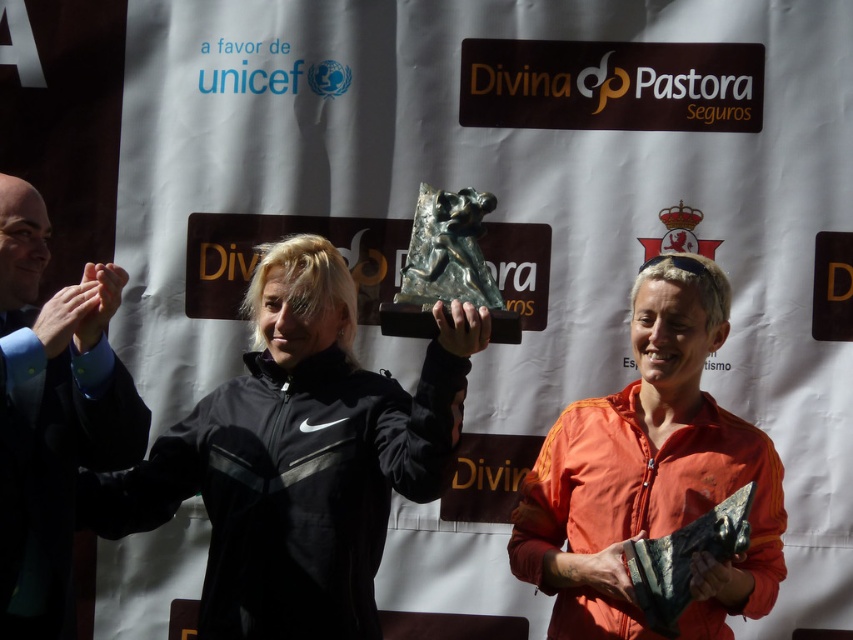
Question: Which of the following is the farthest from the observer?

Choices:
 (A) (585, 404)
 (B) (4, 328)

Answer: (A)

Question: Can you confirm if black matte jacket at center is thinner than dark blue suit at left?

Choices:
 (A) yes
 (B) no

Answer: (B)

Question: Observing the image, what is the correct spatial positioning of orange matte jacket at center in reference to dark blue suit at left?

Choices:
 (A) below
 (B) above

Answer: (A)

Question: Observing the image, what is the correct spatial positioning of black matte jacket at center in reference to dark blue suit at left?

Choices:
 (A) below
 (B) above

Answer: (A)

Question: Which of these objects is positioned farthest from the dark blue suit at left?

Choices:
 (A) black matte jacket at center
 (B) orange matte jacket at center

Answer: (B)

Question: Which is farther from the dark blue suit at left?

Choices:
 (A) black matte jacket at center
 (B) orange matte jacket at center

Answer: (B)